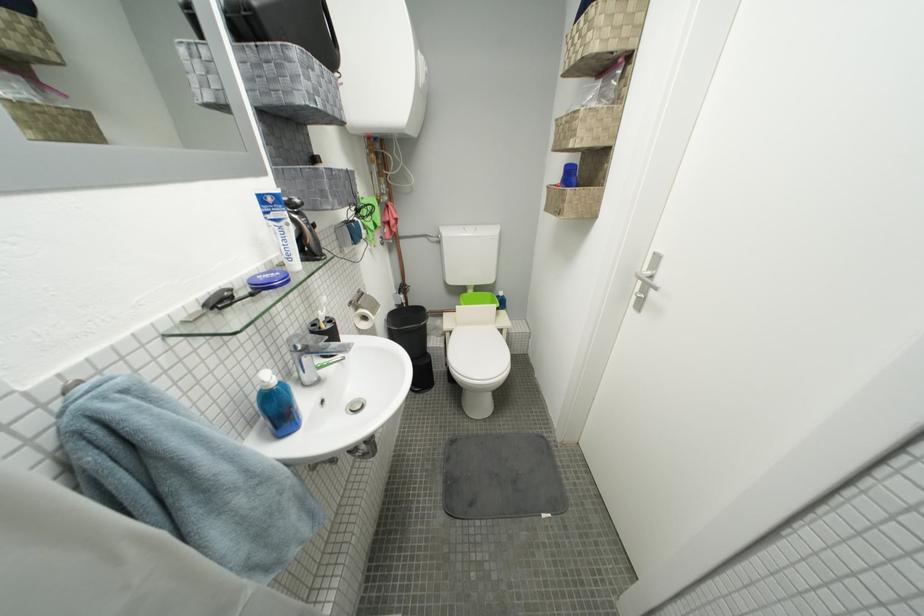
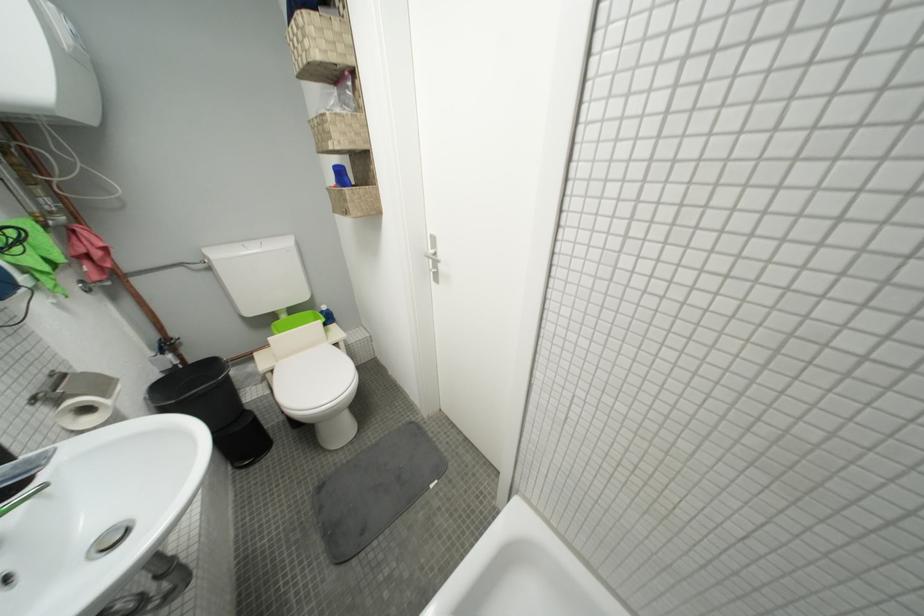
Locate, in the second image, the point that corresponds to pixel 480 294 in the first image.

(293, 318)